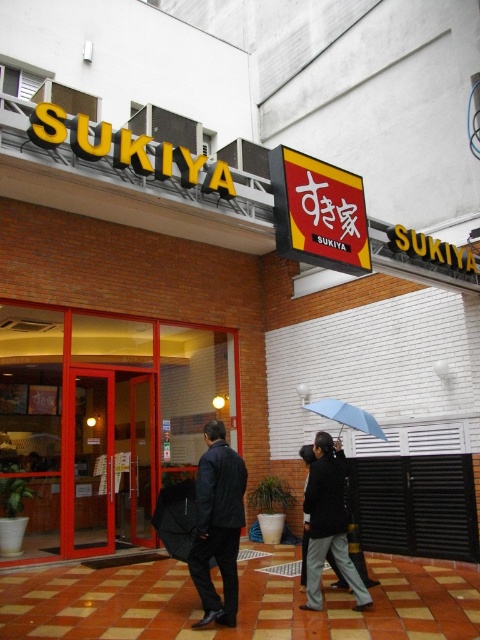
Question: Which of the following is the closest to the observer?

Choices:
 (A) (61, 513)
 (B) (321, 400)
 (C) (315, 598)
 (D) (238, 483)

Answer: (D)

Question: Is matte plastic sign at upper center further to camera compared to blue matte umbrella at center?

Choices:
 (A) no
 (B) yes

Answer: (A)

Question: Considering the relative positions of dark blue jacket at center and black matte umbrella at center in the image provided, where is dark blue jacket at center located with respect to black matte umbrella at center?

Choices:
 (A) below
 (B) above

Answer: (B)

Question: Which point is closer to the camera?

Choices:
 (A) blue matte umbrella at center
 (B) dark gray fabric jacket at center
 (C) dark blue jacket at center
 (D) matte glass door at center

Answer: (C)

Question: Observing the image, what is the correct spatial positioning of dark gray fabric jacket at center in reference to blue matte umbrella at center?

Choices:
 (A) above
 (B) below

Answer: (B)

Question: Which point is farther from the camera taking this photo?

Choices:
 (A) (38, 364)
 (B) (357, 428)
 (C) (233, 573)

Answer: (A)